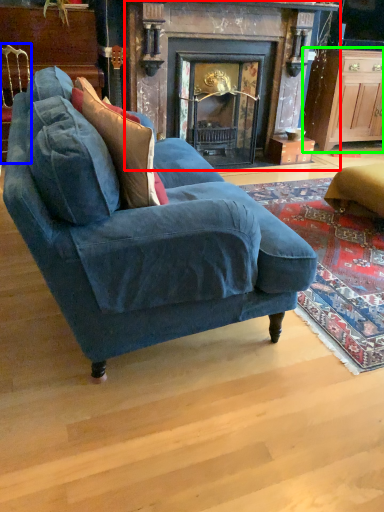
Question: Based on their relative distances, which object is farther from fireplace (highlighted by a red box)? Choose from chair (highlighted by a blue box) and cabinetry (highlighted by a green box).

Choices:
 (A) chair
 (B) cabinetry

Answer: (A)